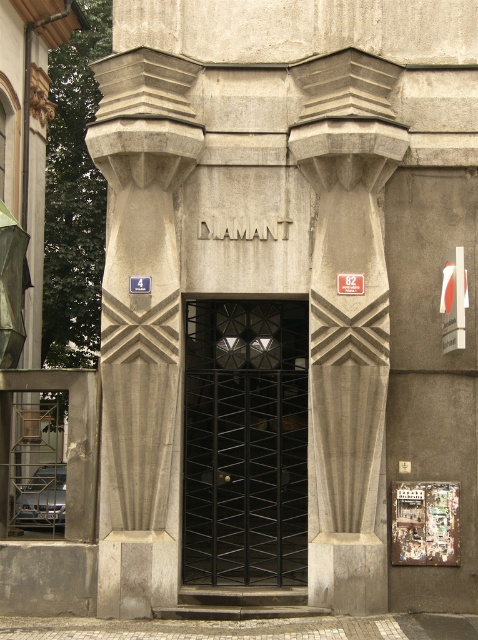
Question: Is gray concrete column at center smaller than black metal gate at center?

Choices:
 (A) yes
 (B) no

Answer: (B)

Question: Can you confirm if gray concrete column at center is positioned to the left of white plastic sign at right?

Choices:
 (A) no
 (B) yes

Answer: (B)

Question: Among these points, which one is nearest to the camera?

Choices:
 (A) (446, 292)
 (B) (149, 163)

Answer: (A)

Question: Is gray stone column at center wider than black metal gate at center?

Choices:
 (A) no
 (B) yes

Answer: (A)

Question: Which point is closer to the camera?

Choices:
 (A) white plastic sign at right
 (B) gray concrete column at center

Answer: (A)

Question: Which is farther from the white plastic sign at right?

Choices:
 (A) gray stone column at center
 (B) black metal gate at center
 (C) gray concrete column at center

Answer: (A)